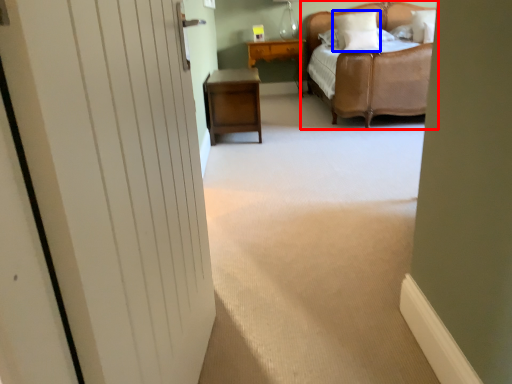
Question: Among these objects, which one is farthest to the camera, bed (highlighted by a red box) or pillow (highlighted by a blue box)?

Choices:
 (A) bed
 (B) pillow

Answer: (B)